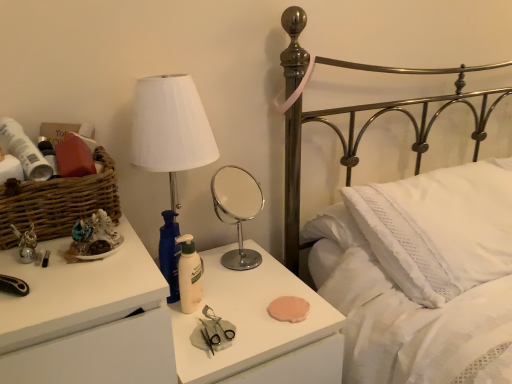
Where is `matte plastic lotion at center, which appears as the first nightstand when viewed from the right`? matte plastic lotion at center, which appears as the first nightstand when viewed from the right is located at coordinates (259, 328).

Describe the element at coordinates (259, 328) in the screenshot. I see `matte plastic lotion at center, which appears as the first nightstand when viewed from the right` at that location.

The height and width of the screenshot is (384, 512). What do you see at coordinates (170, 128) in the screenshot? I see `white fabric lampshade at upper left` at bounding box center [170, 128].

Where is `white textured pillow at center`? The image size is (512, 384). white textured pillow at center is located at coordinates (439, 228).

Measure the distance between white matte lotion at center and camera.

They are 39.29 inches apart.

The height and width of the screenshot is (384, 512). What do you see at coordinates (237, 210) in the screenshot? I see `chrome/metallic round mirror at center` at bounding box center [237, 210].

What do you see at coordinates (87, 319) in the screenshot? This screenshot has width=512, height=384. I see `white matte nightstand at left, the 2th nightstand in the right-to-left sequence` at bounding box center [87, 319].

Identify the location of matte plastic lotion at center, which appears as the first nightstand when viewed from the right. (259, 328).

Is metallic brass bed at upper right not close to white fabric lampshade at upper left?

No, metallic brass bed at upper right is not far away from white fabric lampshade at upper left.

Where is `bed below the white fabric lampshade at upper left (from a real-world perspective)`? bed below the white fabric lampshade at upper left (from a real-world perspective) is located at coordinates (422, 275).

Is metallic brass bed at upper right shorter than white fabric lampshade at upper left?

No, metallic brass bed at upper right is not shorter than white fabric lampshade at upper left.

Considering the points (476, 324) and (183, 165), which point is behind, point (476, 324) or point (183, 165)?

The point (476, 324) is more distant.

Is white fabric lampshade at upper left behind chrome/metallic round mirror at center?

No.

From a real-world perspective, is white fabric lampshade at upper left physically below chrome/metallic round mirror at center?

No, from a real-world perspective, white fabric lampshade at upper left is not below chrome/metallic round mirror at center.

Is point (256, 313) behind point (173, 209)?

No.

Where is `table lamp located above the matte plastic lotion at center, which appears as the first nightstand when viewed from the right (from a real-world perspective)`? table lamp located above the matte plastic lotion at center, which appears as the first nightstand when viewed from the right (from a real-world perspective) is located at coordinates (170, 128).

Based on the photo, considering the relative positions of matte plastic lotion at center, which is the second nightstand in left-to-right order, and white fabric lampshade at upper left in the image provided, is matte plastic lotion at center, which is the second nightstand in left-to-right order, to the left or to the right of white fabric lampshade at upper left?

From the image, it's evident that matte plastic lotion at center, which is the second nightstand in left-to-right order, is to the right of white fabric lampshade at upper left.

Does matte plastic lotion at center, which is the second nightstand in left-to-right order, have a lesser height compared to white fabric lampshade at upper left?

Incorrect, the height of matte plastic lotion at center, which is the second nightstand in left-to-right order, does not fall short of that of white fabric lampshade at upper left.

From a real-world perspective, is metallic brass bed at upper right above or below chrome/metallic round mirror at center?

Clearly, from a real-world perspective, metallic brass bed at upper right is below chrome/metallic round mirror at center.

Considering the points (463, 248) and (252, 204), which point is behind, point (463, 248) or point (252, 204)?

The point (252, 204) is more distant.

Is metallic brass bed at upper right turned away from chrome/metallic round mirror at center?

No.

Would you say chrome/metallic round mirror at center is part of metallic brass bed at upper right's contents?

No, chrome/metallic round mirror at center is not surrounded by metallic brass bed at upper right.

Does white fabric lampshade at upper left touch white matte lotion at center?

There is a gap between white fabric lampshade at upper left and white matte lotion at center.

Does point (179, 150) come farther from viewer compared to point (187, 254)?

No, it is in front of (187, 254).

Does white fabric lampshade at upper left have a greater width compared to white matte lotion at center?

Yes, white fabric lampshade at upper left is wider than white matte lotion at center.

Is metallic brass bed at upper right not near matte plastic lotion at center, which appears as the first nightstand when viewed from the right?

No, there isn't a large distance between metallic brass bed at upper right and matte plastic lotion at center, which appears as the first nightstand when viewed from the right.

Is point (350, 124) positioned after point (338, 322)?

That is True.

Considering the relative positions of metallic brass bed at upper right and matte plastic lotion at center, which is the second nightstand in left-to-right order, in the image provided, is metallic brass bed at upper right to the left of matte plastic lotion at center, which is the second nightstand in left-to-right order, from the viewer's perspective?

No.

Starting from the metallic brass bed at upper right, which nightstand is the 2nd one behind? Please provide its 2D coordinates.

[(259, 328)]

Is white matte nightstand at left, the 2th nightstand in the right-to-left sequence, not close to white matte lotion at center?

They are positioned close to each other.

Based on the photo, which is nearer, [60,258] or [199,279]?

Point [60,258] is positioned closer to the camera compared to point [199,279].

Considering the relative positions of white matte nightstand at left, the 2th nightstand in the right-to-left sequence, and white matte lotion at center in the image provided, is white matte nightstand at left, the 2th nightstand in the right-to-left sequence, to the right of white matte lotion at center from the viewer's perspective?

No.

Considering the positions of objects white matte nightstand at left, placed as the first nightstand when sorted from left to right, and white matte lotion at center in the image provided, who is in front, white matte nightstand at left, placed as the first nightstand when sorted from left to right, or white matte lotion at center?

Positioned in front is white matte nightstand at left, placed as the first nightstand when sorted from left to right.

Where is `bed below the white fabric lampshade at upper left (from a real-world perspective)`? The width and height of the screenshot is (512, 384). bed below the white fabric lampshade at upper left (from a real-world perspective) is located at coordinates (422, 275).

Locate an element on the screen. table lamp on the left of chrome/metallic round mirror at center is located at coordinates (170, 128).

Looking at the image, which one is located further to brown woven basket at left, chrome/metallic round mirror at center or matte plastic lotion at center, which appears as the first nightstand when viewed from the right?

chrome/metallic round mirror at center.

Looking at the image, which one is located further to metallic brass bed at upper right, white matte lotion at center or chrome/metallic round mirror at center?

white matte lotion at center is positioned further to the anchor metallic brass bed at upper right.

Which object lies further to the anchor point brown woven basket at left, metallic brass bed at upper right or chrome/metallic round mirror at center?

metallic brass bed at upper right lies further to brown woven basket at left than the other object.

Based on their spatial positions, is brown woven basket at left or matte plastic lotion at center, which appears as the first nightstand when viewed from the right, closer to white matte nightstand at left, the 2th nightstand in the right-to-left sequence?

brown woven basket at left.

From the image, which object appears to be nearer to white matte nightstand at left, placed as the first nightstand when sorted from left to right, brown woven basket at left or white fabric lampshade at upper left?

Among the two, brown woven basket at left is located nearer to white matte nightstand at left, placed as the first nightstand when sorted from left to right.

Estimate the real-world distances between objects in this image. Which object is closer to white textured pillow at center, brown woven basket at left or metallic brass bed at upper right?

metallic brass bed at upper right.

Looking at the image, which one is located further to white textured pillow at center, white matte lotion at center or white matte nightstand at left, placed as the first nightstand when sorted from left to right?

white matte nightstand at left, placed as the first nightstand when sorted from left to right, is further to white textured pillow at center.

Which object lies nearer to the anchor point white matte lotion at center, white textured pillow at center or white matte nightstand at left, placed as the first nightstand when sorted from left to right?

white matte nightstand at left, placed as the first nightstand when sorted from left to right, is positioned closer to the anchor white matte lotion at center.

Where is `bottle positioned between white fabric lampshade at upper left and chrome/metallic round mirror at center from near to far`? bottle positioned between white fabric lampshade at upper left and chrome/metallic round mirror at center from near to far is located at coordinates pos(189,275).

This screenshot has height=384, width=512. What are the coordinates of `basket between white fabric lampshade at upper left and matte plastic lotion at center, which appears as the first nightstand when viewed from the right, from top to bottom` in the screenshot? It's located at (58, 202).

Find the location of a particular element. The width and height of the screenshot is (512, 384). pillow between white fabric lampshade at upper left and metallic brass bed at upper right from left to right is located at coordinates (439, 228).

Locate an element on the screen. The width and height of the screenshot is (512, 384). nightstand between white matte nightstand at left, the 2th nightstand in the right-to-left sequence, and metallic brass bed at upper right is located at coordinates (259, 328).